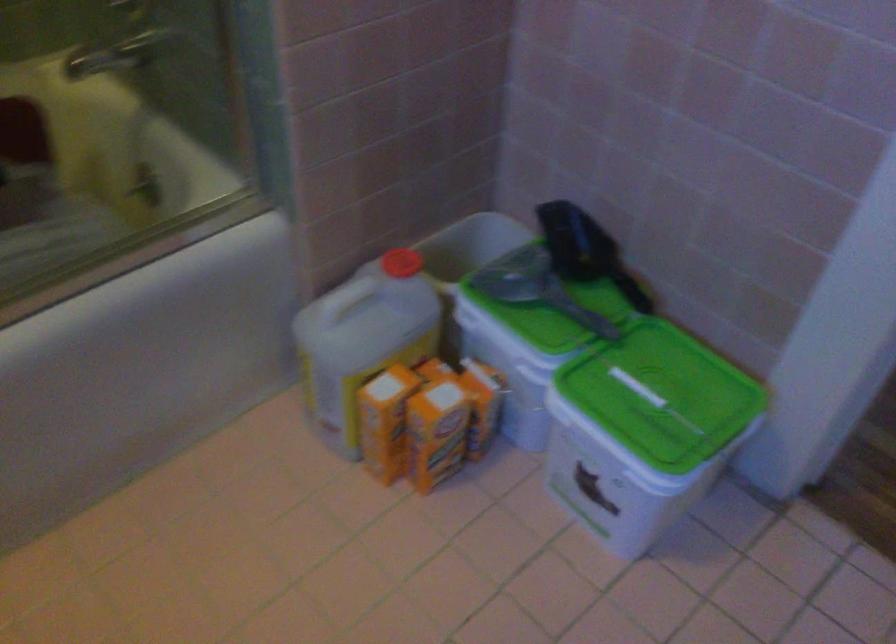
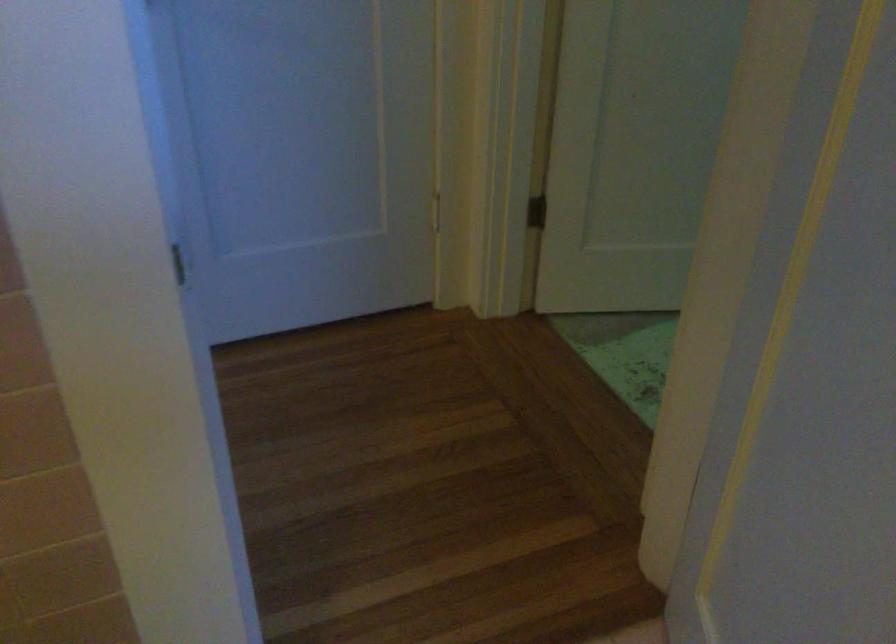
Question: Based on the continuous images, in which direction is the camera rotating? Reply with the corresponding letter.

Choices:
 (A) Left
 (B) Right
 (C) Up
 (D) Down

Answer: (B)